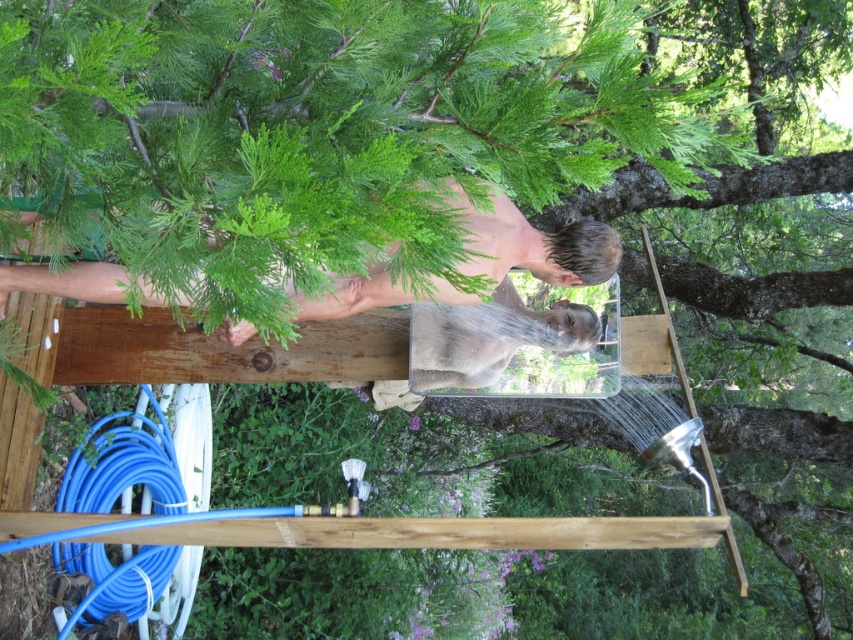
You are setting up an outdoor shower and need to connect the blue rubber hose at lower left to the showerhead. Since the brown wood beam at center is in the way, can you easily access the hose without moving the beam?

The brown wood beam at center is above the blue rubber hose at lower left, so you can access the hose by moving around or underneath the beam without needing to move it.

You are a gardener who needs to water the plants using the blue rubber hose at lower left. However, there is a smooth skin man at center in the way. Can you move the hose to avoid him?

The smooth skin man at center has a smaller size compared to blue rubber hose at lower left. Since the man is smaller, you can move around him to access the blue rubber hose at lower left.

You are standing in the outdoor shower area and need to locate the brown wood beam at center. Based on the coordinates provided, where would you find it in relation to the showerhead?

The brown wood beam at center is located at coordinates point (434, 532), which is to the right of the showerhead since the showerhead is on one side of the shower area.